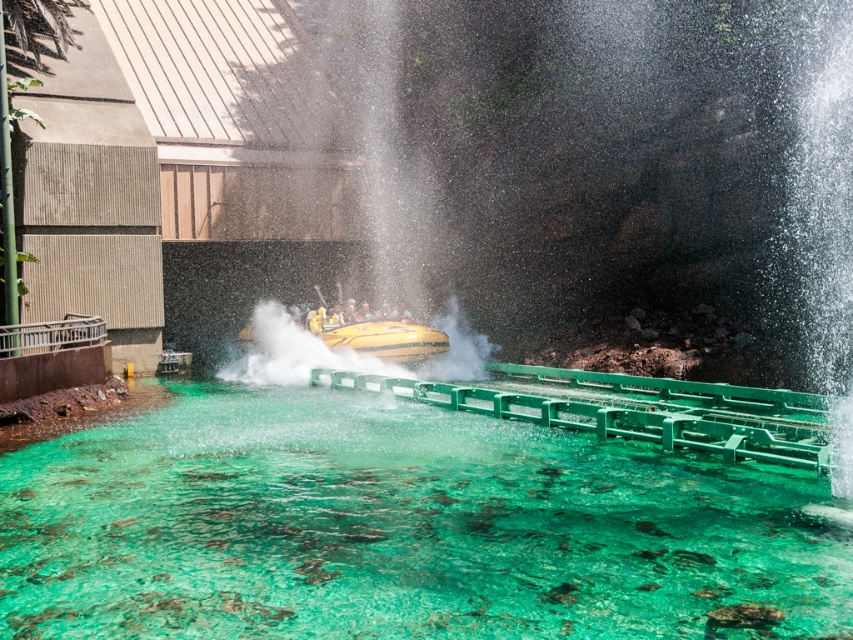
Is translucent green water at center closer to camera compared to yellow rubber boat at center?

Yes.

Does point (628, 540) come behind point (341, 317)?

No, (628, 540) is in front of (341, 317).

Identify the location of translucent green water at center. The width and height of the screenshot is (853, 640). (403, 529).

Can you confirm if translucent green water at center is positioned to the left of yellow matte raft at center?

Yes, translucent green water at center is to the left of yellow matte raft at center.

Who is more distant from viewer, (282,584) or (357,337)?

The point (357,337) is behind.

Where is `translucent green water at center`? translucent green water at center is located at coordinates (403, 529).

Can you confirm if yellow matte raft at center is positioned below yellow rubber boat at center?

Yes, yellow matte raft at center is below yellow rubber boat at center.

Is point (376, 342) behind point (350, 323)?

No, it is in front of (350, 323).

Where is `yellow matte raft at center`? yellow matte raft at center is located at coordinates (376, 337).